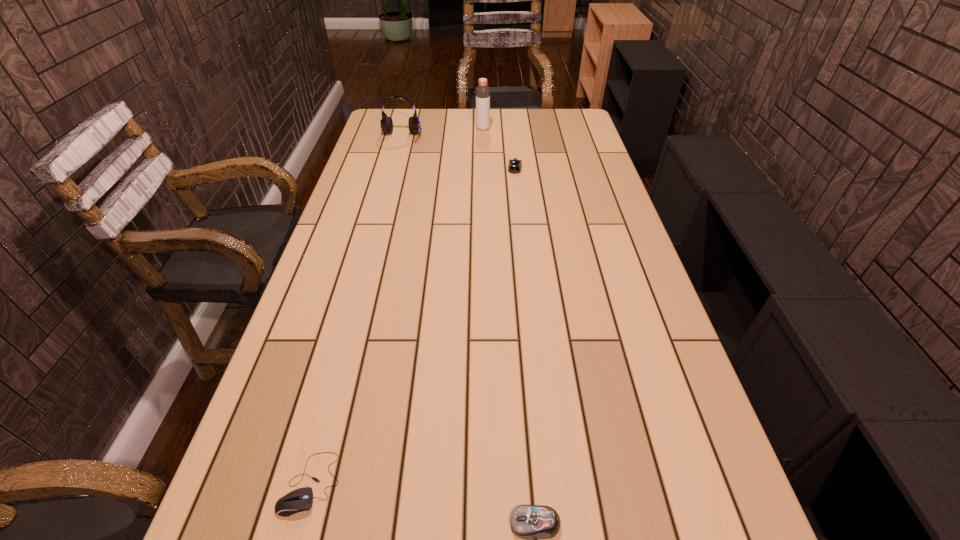
Identify the location of bottle. (482, 92).

Identify the location of the tallest object. (482, 92).

You are a GUI agent. You are given a task and a screenshot of the screen. Output one action in this format:
    pyautogui.click(x=<x>, y=<y>)
    Task: Click on the second tallest object
    
    Given the screenshot: What is the action you would take?
    pyautogui.click(x=386, y=122)

I want to click on the farthest computer mouse, so click(514, 166).

This screenshot has width=960, height=540. Identify the location of the shortest computer mouse. (299, 500).

In order to click on the shortest object in this screenshot , I will do `click(299, 500)`.

The height and width of the screenshot is (540, 960). Find the location of `free location located 0.260m on the front of the bottle`. free location located 0.260m on the front of the bottle is located at coordinates (483, 163).

Where is `vacant space situated 0.350m on the ear cushions of the fourth shortest object`? vacant space situated 0.350m on the ear cushions of the fourth shortest object is located at coordinates (385, 197).

Locate an element on the screen. Image resolution: width=960 pixels, height=540 pixels. free space located 0.210m on the left of the third nearest object is located at coordinates (451, 168).

The width and height of the screenshot is (960, 540). What are the coordinates of `vacant space situated on the right of the shortest computer mouse` in the screenshot? It's located at (366, 483).